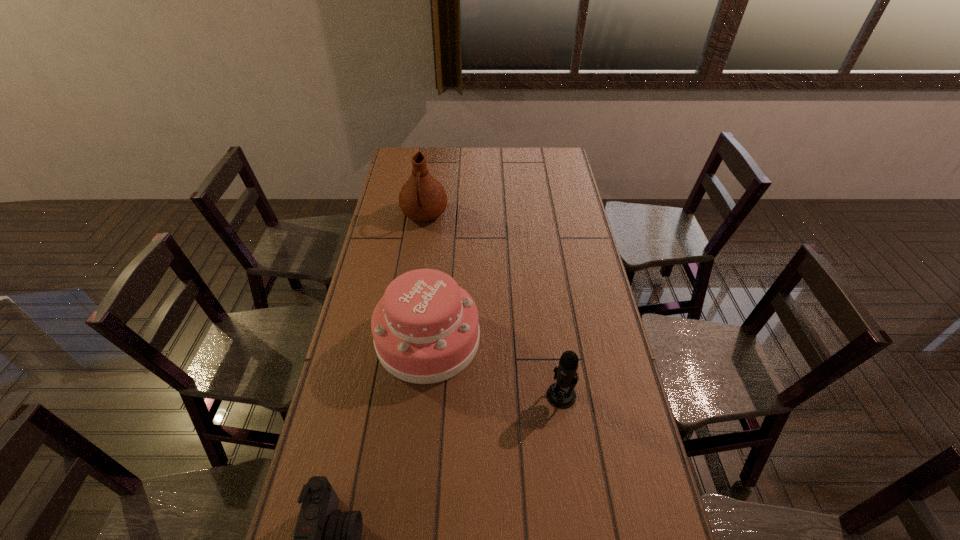
I want to click on pitcher, so click(422, 198).

Where is `the tallest object`? The image size is (960, 540). the tallest object is located at coordinates (422, 198).

Locate an element on the screen. birthday cake is located at coordinates (426, 330).

Where is `microphone`? microphone is located at coordinates (561, 394).

Find the location of a particular element. This screenshot has width=960, height=540. blank space located on the side of the farthest object with the handle is located at coordinates (419, 256).

Image resolution: width=960 pixels, height=540 pixels. What are the coordinates of `blank area located 0.090m on the right of the birthday cake` in the screenshot? It's located at (508, 340).

The image size is (960, 540). Identify the location of blank space located 0.090m on the back of the microphone. (556, 357).

You are a GUI agent. You are given a task and a screenshot of the screen. Output one action in this format:
    pyautogui.click(x=<x>, y=<y>)
    Task: Click on the pitcher at the left edge
    This screenshot has width=960, height=540.
    Given the screenshot: What is the action you would take?
    pyautogui.click(x=422, y=198)

I want to click on birthday cake at the left edge, so click(x=426, y=330).

At what (x,y) coordinates should I click in order to perform the action: click on object that is positioned at the right edge. Please return your answer as a coordinate pair (x, y). This screenshot has height=540, width=960. Looking at the image, I should click on pos(561,394).